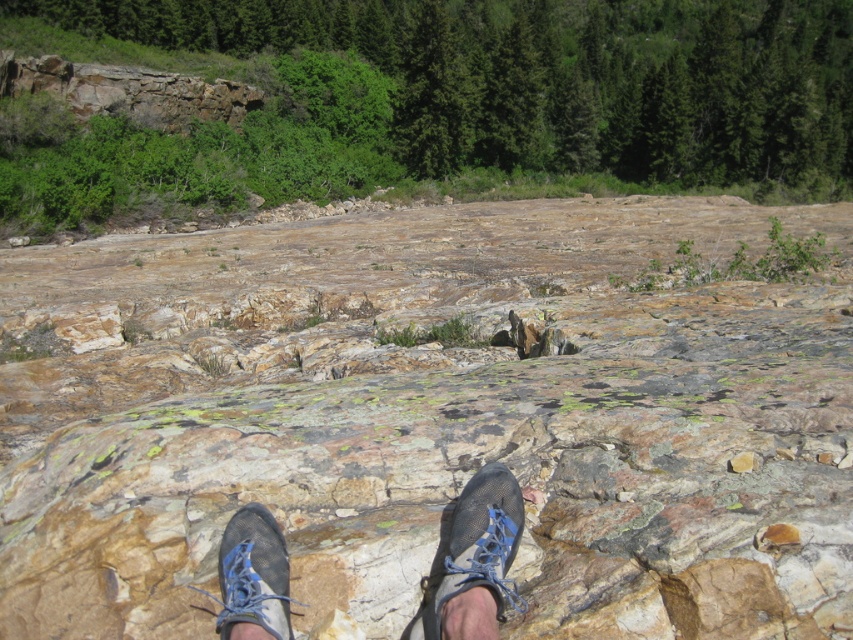
Does point (511, 474) come behind point (271, 563)?

Yes.

Who is taller, matte gray shoe at center or matte black shoe at center?

matte gray shoe at center

Which is behind, point (492, 508) or point (263, 509)?

The point (263, 509) is more distant.

Find the location of a particular element. This screenshot has width=853, height=640. matte gray shoe at center is located at coordinates (474, 548).

Is the position of textured gray shoes at center more distant than that of matte gray shoe at center?

No.

Which is in front, point (518, 499) or point (480, 582)?

Positioned in front is point (480, 582).

You are a GUI agent. You are given a task and a screenshot of the screen. Output one action in this format:
    pyautogui.click(x=<x>, y=<y>)
    Task: Click on the textured gray shoes at center
    
    Given the screenshot: What is the action you would take?
    pyautogui.click(x=474, y=561)

Can you confirm if textured gray shoes at center is thinner than matte black shoe at center?

In fact, textured gray shoes at center might be wider than matte black shoe at center.

Which of these two, textured gray shoes at center or matte black shoe at center, stands shorter?

Standing shorter between the two is matte black shoe at center.

Between point (258, 577) and point (252, 582), which one is positioned behind?

The point (258, 577) is more distant.

I want to click on textured gray shoes at center, so click(x=474, y=561).